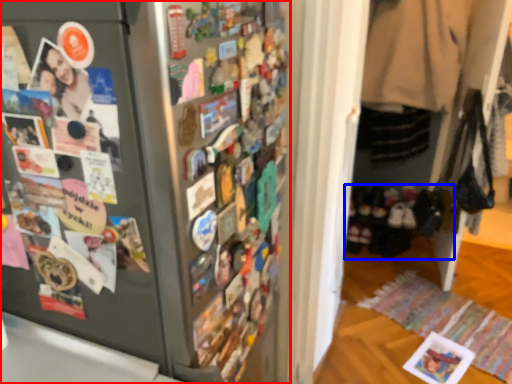
Question: Which of the following is the closest to the observer, refrigerator (highlighted by a red box) or footwear (highlighted by a blue box)?

Choices:
 (A) refrigerator
 (B) footwear

Answer: (A)